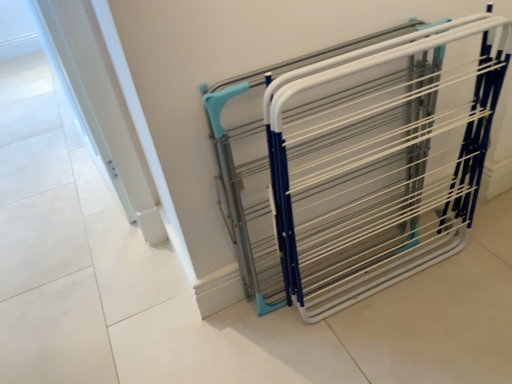
The height and width of the screenshot is (384, 512). I want to click on vacant space underneath white metal gate at center (from a real-world perspective), so click(381, 278).